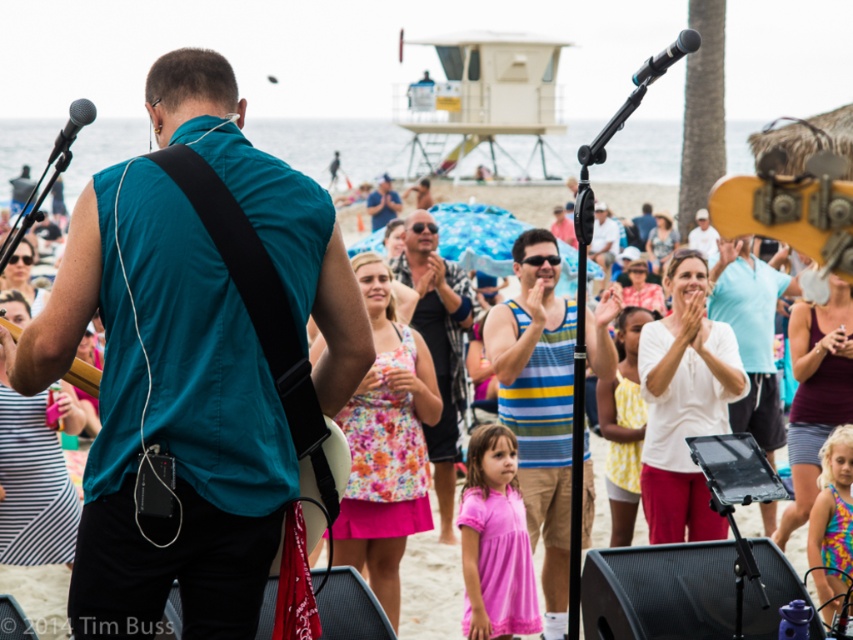
Question: Does wooden acoustic guitar at upper right have a lesser width compared to black metallic microphone at upper center?

Choices:
 (A) no
 (B) yes

Answer: (A)

Question: Among these objects, which one is nearest to the camera?

Choices:
 (A) striped cotton tank top at center
 (B) teal fabric shirt at center
 (C) white striped tank top at center

Answer: (C)

Question: Considering the real-world distances, which object is closest to the floral fabric shirt at center?

Choices:
 (A) striped cotton tank top at center
 (B) white striped tank top at center
 (C) black metallic microphone at upper center

Answer: (B)

Question: Which point is closer to the camera?

Choices:
 (A) (556, 257)
 (B) (845, 184)

Answer: (B)

Question: Does floral fabric shirt at center appear over teal fabric guitar at center?

Choices:
 (A) yes
 (B) no

Answer: (A)

Question: Can you confirm if white striped tank top at center is positioned above matte black microphone at upper left?

Choices:
 (A) yes
 (B) no

Answer: (B)